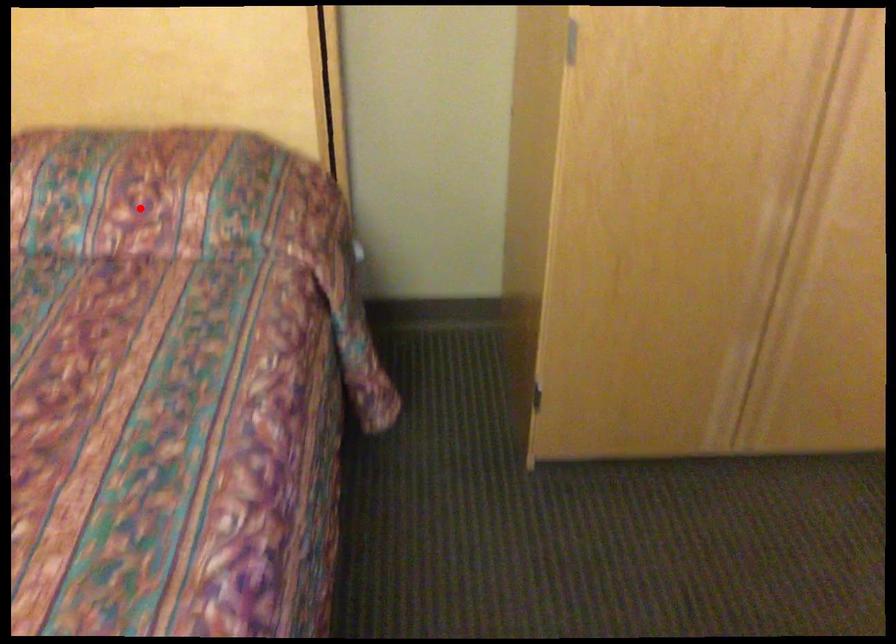
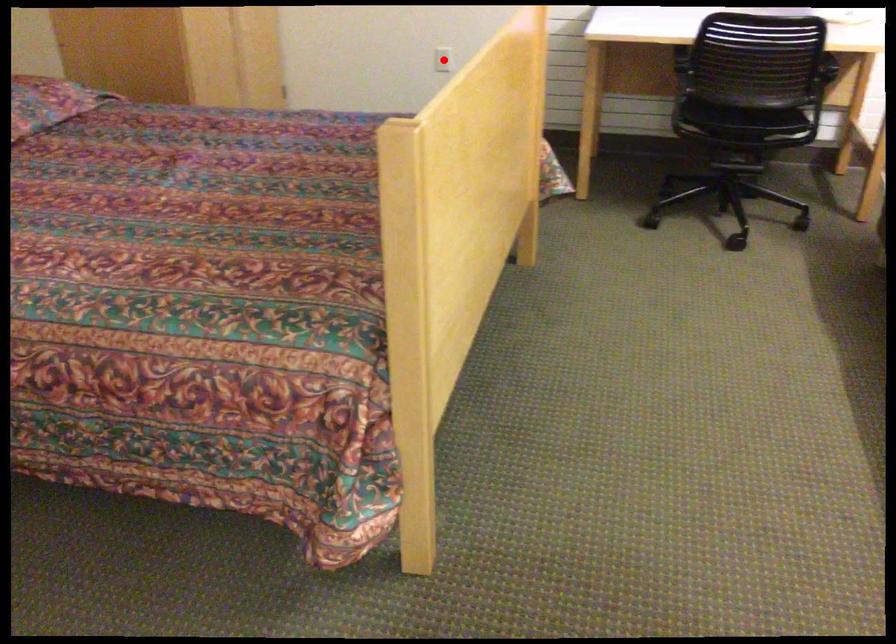
I am providing you with two images of the same scene from different viewpoints. A red point is marked on the first image and another point is marked on the second image. Does the point marked in image1 correspond to the same location as the one in image2?

No